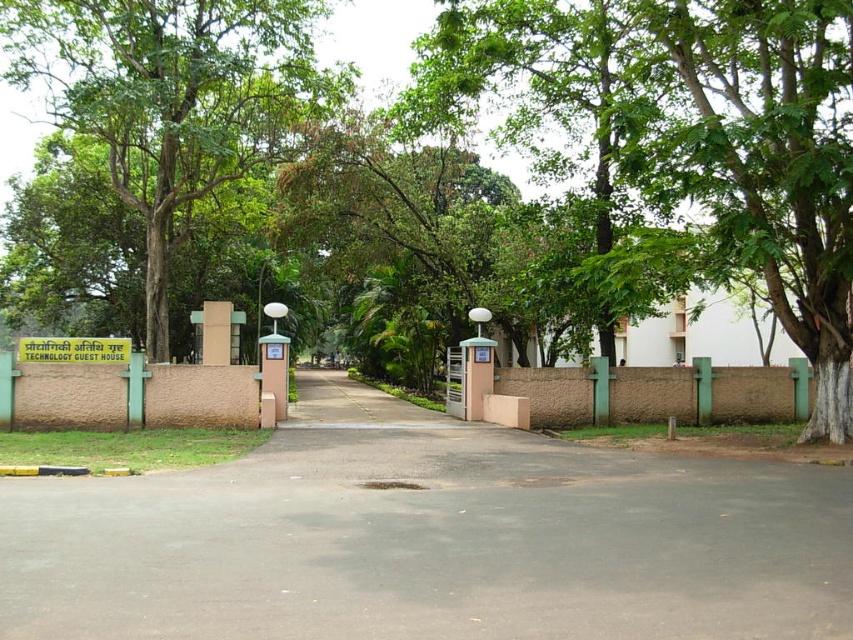
You are a guest arriving at the Technology Guest House and need to locate the entrance. You see a green leafy tree at center and a green plastic sign at center. Which object is closer to the entrance?

The green plastic sign at center is closer to the entrance because the green leafy tree at center is located above it, meaning the tree is further back.

You are driving a car that requires a 10 meter wide path to turn around. You see the black asphalt driveway at center and the green plastic sign at center. Which one can accommodate your car for turning around?

The black asphalt driveway at center has a larger size compared to the green plastic sign at center, so it can accommodate the car for turning around as it requires a 10 meter wide path.

Looking at this image, you are standing at the entrance of the Technology Guest House and want to walk to the point labeled point (64, 346). Which direction should you move relative to the other point labeled point (712, 76)?

You should move towards the direction away from point (712, 76) because point (712, 76) is in front of point (64, 346), meaning it is closer to your current position at the entrance.